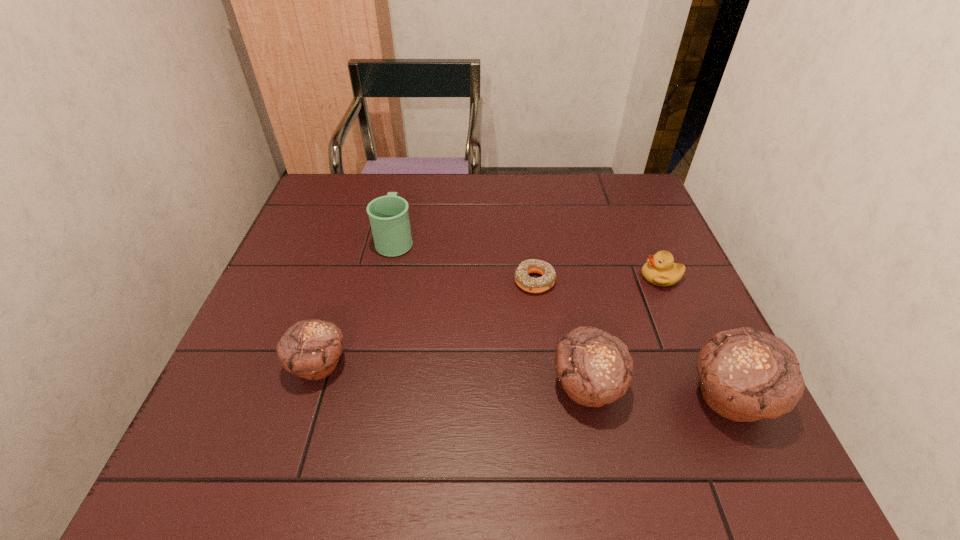
Identify the location of free space between the doughnut and the rightmost muffin. The height and width of the screenshot is (540, 960). (633, 340).

Identify the location of blank region between the fifth tallest object and the second muffin from right to left. Image resolution: width=960 pixels, height=540 pixels. (624, 332).

The width and height of the screenshot is (960, 540). Find the location of `vacant space that's between the shortest muffin and the second muffin from right to left`. vacant space that's between the shortest muffin and the second muffin from right to left is located at coordinates (453, 375).

Where is `unoccupied area between the leftmost muffin and the mug`? The width and height of the screenshot is (960, 540). unoccupied area between the leftmost muffin and the mug is located at coordinates (357, 302).

At what (x,y) coordinates should I click in order to perform the action: click on free space between the second muffin from right to left and the farthest object. Please return your answer as a coordinate pair (x, y). The height and width of the screenshot is (540, 960). Looking at the image, I should click on (492, 313).

Where is `free space between the fifth tallest object and the shortest object`? This screenshot has width=960, height=540. free space between the fifth tallest object and the shortest object is located at coordinates (597, 279).

The width and height of the screenshot is (960, 540). In order to click on empty space between the shortest object and the farthest object in this screenshot , I will do `click(465, 261)`.

Image resolution: width=960 pixels, height=540 pixels. I want to click on free space between the shortest object and the mug, so click(465, 261).

You are a GUI agent. You are given a task and a screenshot of the screen. Output one action in this format:
    pyautogui.click(x=<x>, y=<y>)
    Task: Click on the vacant area that lies between the duckling and the rightmost muffin
    
    Given the screenshot: What is the action you would take?
    pyautogui.click(x=695, y=338)

Identify which object is located as the fourth nearest to the rightmost muffin. Please provide its 2D coordinates. Your answer should be formatted as a tuple, i.e. [(x, y)], where the tuple contains the x and y coordinates of a point satisfying the conditions above.

[(389, 218)]